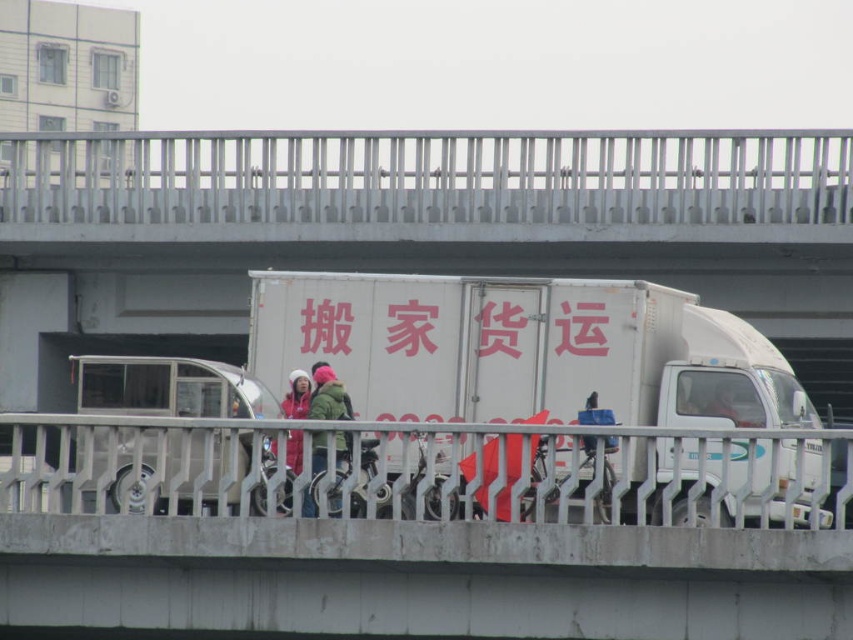
Does pink matte sign at center have a smaller size compared to green fuzzy jacket at center?

Correct, pink matte sign at center occupies less space than green fuzzy jacket at center.

Measure the distance between point (502, 324) and camera.

They are 58.80 meters apart.

The image size is (853, 640). What do you see at coordinates (415, 326) in the screenshot?
I see `pink matte sign at center` at bounding box center [415, 326].

Where is `pink matte sign at center`? pink matte sign at center is located at coordinates (415, 326).

Which of these two, white matte truck at center or pink matte sign at center, stands taller?

white matte truck at center is taller.

Does point (744, 444) lie in front of point (373, 304)?

Yes.

Is point (605, 401) in front of point (601, 337)?

Yes.

You are a GUI agent. You are given a task and a screenshot of the screen. Output one action in this format:
    pyautogui.click(x=<x>, y=<y>)
    Task: Click on the white matte truck at center
    The width and height of the screenshot is (853, 640).
    Given the screenshot: What is the action you would take?
    pyautogui.click(x=521, y=349)

Does white metal railing at upper center have a lesser width compared to green fuzzy jacket at center?

Incorrect, white metal railing at upper center's width is not less than green fuzzy jacket at center's.

Does point (743, 170) lie behind point (320, 376)?

Yes, it is.

Find the location of a particular element. The width and height of the screenshot is (853, 640). white metal railing at upper center is located at coordinates (427, 188).